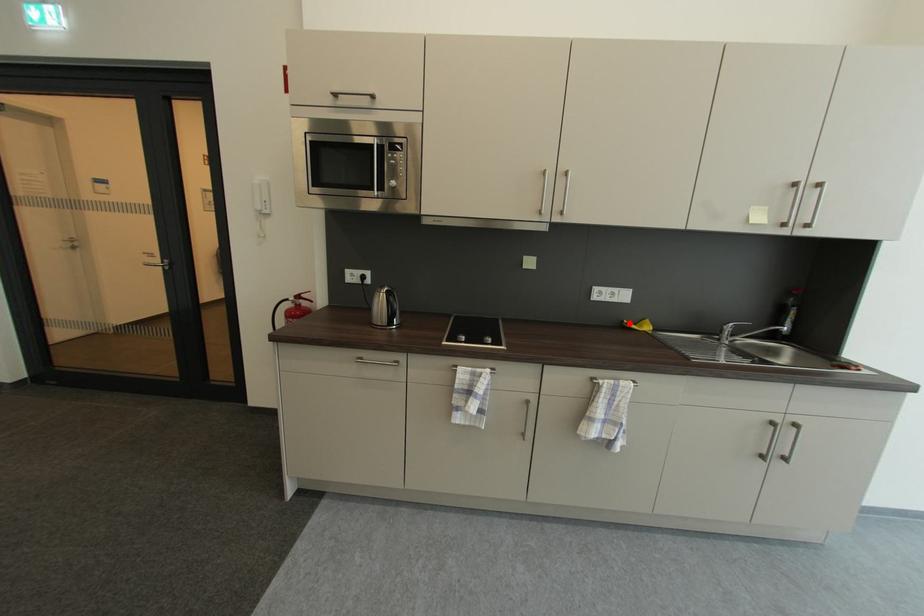
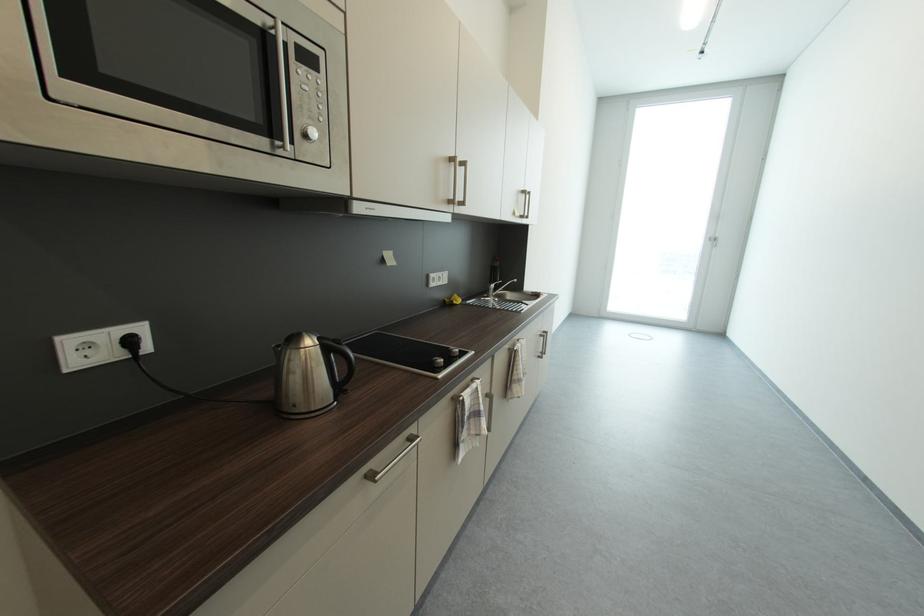
Find the pixel in the second image that matches the highlighted location in the first image.

(453, 302)